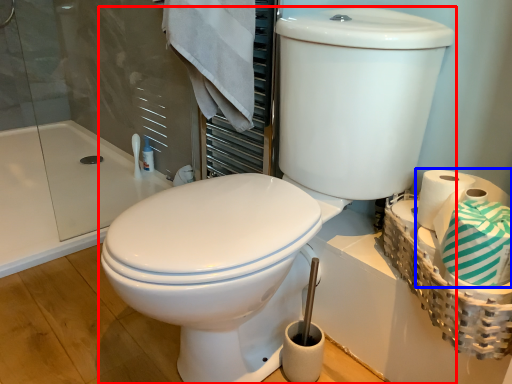
Question: Which of the following is the farthest to the observer, toilet (highlighted by a red box) or toilet paper (highlighted by a blue box)?

Choices:
 (A) toilet
 (B) toilet paper

Answer: (B)